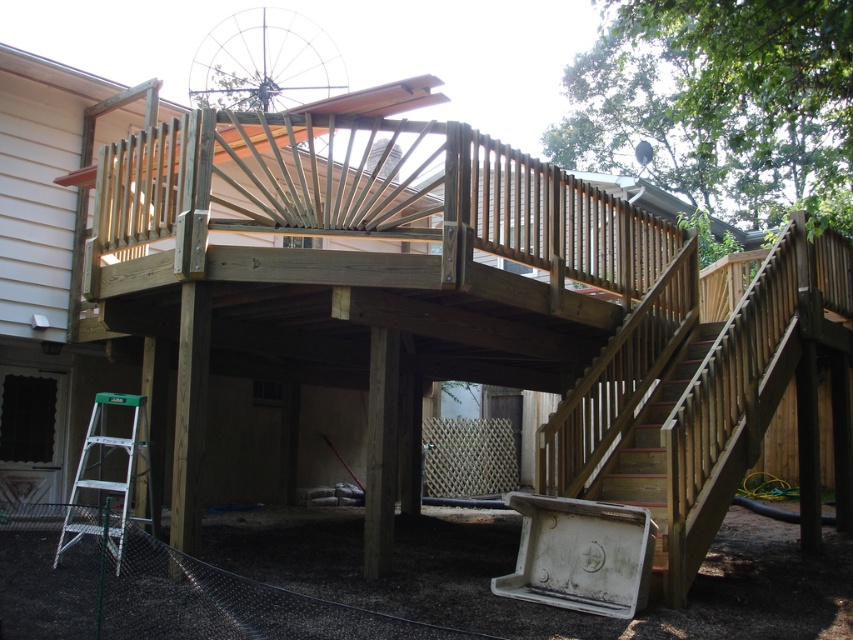
You are standing at the base of the staircase looking up at the partially constructed deck. There are two points marked on the deck structure. Based on their positions, which point is closer to you, point (119, 529) or point (648, 486)?

Point (119, 529) is closer to the viewer than point (648, 486).